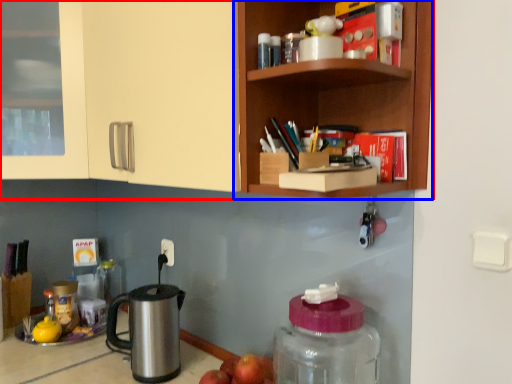
Question: Among these objects, which one is nearest to the camera, cabinetry (highlighted by a red box) or shelf (highlighted by a blue box)?

Choices:
 (A) cabinetry
 (B) shelf

Answer: (A)